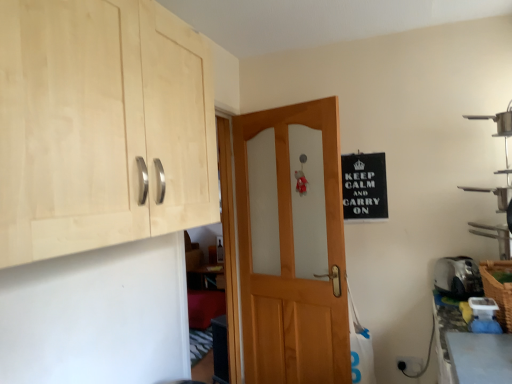
You are a GUI agent. You are given a task and a screenshot of the screen. Output one action in this format:
    pyautogui.click(x=<x>, y=<y>)
    Task: Click on the wooden door at center
    
    Given the screenshot: What is the action you would take?
    pyautogui.click(x=292, y=246)

Where is `natural wood cabinet at upper left`? The image size is (512, 384). natural wood cabinet at upper left is located at coordinates (101, 126).

What do you see at coordinates (101, 126) in the screenshot? This screenshot has width=512, height=384. I see `natural wood cabinet at upper left` at bounding box center [101, 126].

Locate an element on the screen. The width and height of the screenshot is (512, 384). woven brown basket at lower right is located at coordinates (498, 291).

Locate an element on the screen. This screenshot has width=512, height=384. wooden door at center is located at coordinates (292, 246).

Consider the image. Is woven brown basket at lower right oriented away from natural wood cabinet at upper left?

No.

Considering the points (490, 283) and (79, 48), which point is behind, point (490, 283) or point (79, 48)?

The point (490, 283) is behind.

From the image's perspective, which one is positioned lower, woven brown basket at lower right or natural wood cabinet at upper left?

From the image's view, woven brown basket at lower right is below.

From a real-world perspective, is woven brown basket at lower right positioned above or below wooden door at center?

woven brown basket at lower right is situated lower than wooden door at center in the real world.

Does woven brown basket at lower right have a lesser width compared to wooden door at center?

No.

Considering the sizes of woven brown basket at lower right and wooden door at center in the image, is woven brown basket at lower right taller or shorter than wooden door at center?

In the image, woven brown basket at lower right appears to be shorter than wooden door at center.

Measure the distance from woven brown basket at lower right to wooden door at center.

woven brown basket at lower right is 1.12 meters from wooden door at center.

From a real-world perspective, between natural wood cabinet at upper left and black paper sign at upper right, who is vertically lower?

black paper sign at upper right, from a real-world perspective.

Is natural wood cabinet at upper left far from black paper sign at upper right?

natural wood cabinet at upper left is positioned a significant distance from black paper sign at upper right.

Is natural wood cabinet at upper left positioned beyond the bounds of black paper sign at upper right?

natural wood cabinet at upper left lies outside black paper sign at upper right's area.

The width and height of the screenshot is (512, 384). Find the location of `bulletin board beneath the natural wood cabinet at upper left (from a real-world perspective)`. bulletin board beneath the natural wood cabinet at upper left (from a real-world perspective) is located at coordinates (364, 186).

From the image's perspective, is metallic silver shelf at right on natural wood cabinet at upper left?

No.

In terms of width, does metallic silver shelf at right look wider or thinner when compared to natural wood cabinet at upper left?

In the image, metallic silver shelf at right appears to be more narrow than natural wood cabinet at upper left.

Are metallic silver shelf at right and natural wood cabinet at upper left located far from each other?

Yes, metallic silver shelf at right and natural wood cabinet at upper left are located far from each other.

Which object is positioned more to the right, metallic silver shelf at right or woven brown basket at lower right?

Positioned to the right is metallic silver shelf at right.

Is metallic silver shelf at right touching woven brown basket at lower right?

No, metallic silver shelf at right is not touching woven brown basket at lower right.

Is the depth of metallic silver shelf at right greater than that of woven brown basket at lower right?

Yes, the depth of metallic silver shelf at right is greater than that of woven brown basket at lower right.

Is metallic silver shelf at right not within woven brown basket at lower right?

metallic silver shelf at right is positioned outside woven brown basket at lower right.

Is wooden door at center at the right side of silver metallic toaster at lower right?

In fact, wooden door at center is to the left of silver metallic toaster at lower right.

What's the angular difference between wooden door at center and silver metallic toaster at lower right's facing directions?

The angle between the facing direction of wooden door at center and the facing direction of silver metallic toaster at lower right is 43.5 degrees.

Which object is thinner, wooden door at center or silver metallic toaster at lower right?

With smaller width is wooden door at center.

Considering the relative sizes of wooden door at center and silver metallic toaster at lower right in the image provided, is wooden door at center smaller than silver metallic toaster at lower right?

No.

What's the angular difference between silver metallic toaster at lower right and black paper sign at upper right's facing directions?

The angular difference between silver metallic toaster at lower right and black paper sign at upper right is 24.8 degrees.

Where is `appliance below the black paper sign at upper right (from the image's perspective)`? appliance below the black paper sign at upper right (from the image's perspective) is located at coordinates (458, 278).

Considering the relative sizes of silver metallic toaster at lower right and black paper sign at upper right in the image provided, is silver metallic toaster at lower right wider than black paper sign at upper right?

Yes, silver metallic toaster at lower right is wider than black paper sign at upper right.

Can you confirm if silver metallic toaster at lower right is shorter than black paper sign at upper right?

Correct, silver metallic toaster at lower right is not as tall as black paper sign at upper right.

At what (x,y) coordinates should I click in order to perform the action: click on cabinetry above the woven brown basket at lower right (from the image's perspective). Please return your answer as a coordinate pair (x, y). This screenshot has height=384, width=512. Looking at the image, I should click on (101, 126).

Locate an element on the screen. The width and height of the screenshot is (512, 384). basket in front of the wooden door at center is located at coordinates (498, 291).

Based on their spatial positions, is silver metallic toaster at lower right or wooden door at center further from metallic silver shelf at right?

Among the two, wooden door at center is located further to metallic silver shelf at right.

Looking at this image, which object lies further to the anchor point black paper sign at upper right, wooden door at center or black plastic electric outlet at lower right?

black plastic electric outlet at lower right is further to black paper sign at upper right.

When comparing their distances from natural wood cabinet at upper left, does silver metallic toaster at lower right or metallic silver shelf at right seem closer?

Based on the image, silver metallic toaster at lower right appears to be nearer to natural wood cabinet at upper left.

From the picture: From the image, which object appears to be farther from natural wood cabinet at upper left, woven brown basket at lower right or wooden door at center?

woven brown basket at lower right.

Based on the photo, based on their spatial positions, is metallic silver shelf at right or silver metallic toaster at lower right closer to woven brown basket at lower right?

The object closer to woven brown basket at lower right is silver metallic toaster at lower right.

Based on their spatial positions, is woven brown basket at lower right or wooden door at center closer to metallic silver shelf at right?

Based on the image, woven brown basket at lower right appears to be nearer to metallic silver shelf at right.

Based on their spatial positions, is black plastic electric outlet at lower right or metallic silver shelf at right closer to wooden door at center?

Based on the image, black plastic electric outlet at lower right appears to be nearer to wooden door at center.

Which object lies nearer to the anchor point wooden door at center, silver metallic toaster at lower right or black plastic electric outlet at lower right?

Among the two, silver metallic toaster at lower right is located nearer to wooden door at center.

You are a GUI agent. You are given a task and a screenshot of the screen. Output one action in this format:
    pyautogui.click(x=<x>, y=<y>)
    Task: Click on the appliance between woven brown basket at lower right and black plastic electric outlet at lower right from front to back
    This screenshot has height=384, width=512.
    Given the screenshot: What is the action you would take?
    pyautogui.click(x=458, y=278)

Locate an element on the screen. This screenshot has width=512, height=384. basket between natural wood cabinet at upper left and silver metallic toaster at lower right in the horizontal direction is located at coordinates (498, 291).

Image resolution: width=512 pixels, height=384 pixels. I want to click on bulletin board located between wooden door at center and silver metallic toaster at lower right in the left-right direction, so (364, 186).

This screenshot has width=512, height=384. Find the location of `basket between natural wood cabinet at upper left and black plastic electric outlet at lower right in the front-back direction`. basket between natural wood cabinet at upper left and black plastic electric outlet at lower right in the front-back direction is located at coordinates point(498,291).